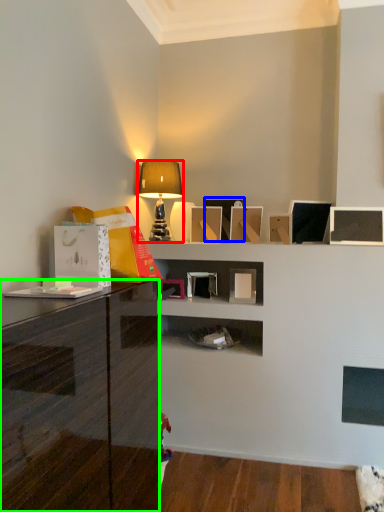
Question: Based on their relative distances, which object is farther from lamp (highlighted by a red box)? Choose from picture frame (highlighted by a blue box) and cabinetry (highlighted by a green box).

Choices:
 (A) picture frame
 (B) cabinetry

Answer: (B)